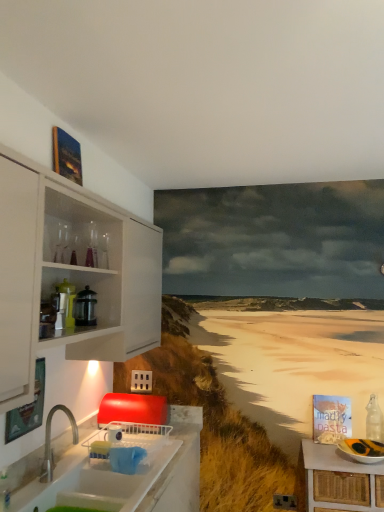
Question: Is clear glass bottle at right inside or outside of white glossy countertop at lower left?

Choices:
 (A) inside
 (B) outside

Answer: (B)

Question: Based on their sizes in the image, would you say clear glass bottle at right is bigger or smaller than white glossy countertop at lower left?

Choices:
 (A) big
 (B) small

Answer: (B)

Question: Considering the real-world distances, which object is farthest from the white glossy countertop at lower left?

Choices:
 (A) white wicker table at lower right
 (B) metallic glass coffee press at upper left
 (C) clear glass bottle at right

Answer: (C)

Question: Estimate the real-world distances between objects in this image. Which object is closer to the metallic glass coffee press at upper left?

Choices:
 (A) white wicker table at lower right
 (B) clear glass bottle at right
 (C) white glossy countertop at lower left

Answer: (C)